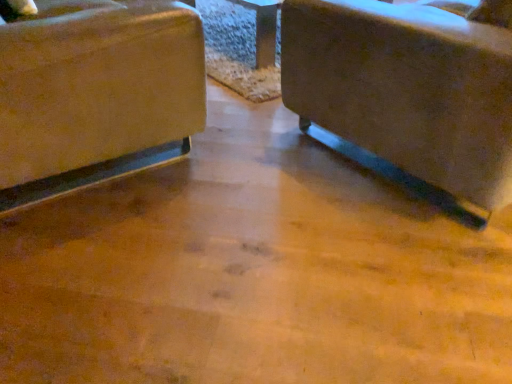
Question: In which direction should I rotate to look at matte brown chair at center, marked as the 1th chair in a right-to-left arrangement?

Choices:
 (A) right
 (B) left

Answer: (A)

Question: Should I look upward or downward to see matte beige fabric chair at left, which is counted as the 2th chair, starting from the right?

Choices:
 (A) up
 (B) down

Answer: (A)

Question: From the image's perspective, is matte beige fabric chair at left, marked as the 1th chair in a left-to-right arrangement, beneath matte brown chair at center, arranged as the 2th chair when viewed from the left?

Choices:
 (A) no
 (B) yes

Answer: (A)

Question: Considering the relative sizes of matte beige fabric chair at left, which is counted as the 2th chair, starting from the right, and matte brown chair at center, arranged as the 2th chair when viewed from the left, in the image provided, is matte beige fabric chair at left, which is counted as the 2th chair, starting from the right, thinner than matte brown chair at center, arranged as the 2th chair when viewed from the left,?

Choices:
 (A) no
 (B) yes

Answer: (B)

Question: Is matte beige fabric chair at left, which is counted as the 2th chair, starting from the right, positioned beyond the bounds of matte brown chair at center, marked as the 1th chair in a right-to-left arrangement?

Choices:
 (A) no
 (B) yes

Answer: (B)

Question: Is matte beige fabric chair at left, which is counted as the 2th chair, starting from the right, facing away from matte brown chair at center, arranged as the 2th chair when viewed from the left?

Choices:
 (A) no
 (B) yes

Answer: (A)

Question: Does matte beige fabric chair at left, which is counted as the 2th chair, starting from the right, appear on the left side of matte brown chair at center, arranged as the 2th chair when viewed from the left?

Choices:
 (A) no
 (B) yes

Answer: (B)

Question: Is matte brown chair at center, arranged as the 2th chair when viewed from the left, located within matte beige fabric chair at left, which is counted as the 2th chair, starting from the right?

Choices:
 (A) no
 (B) yes

Answer: (A)

Question: Does matte brown chair at center, marked as the 1th chair in a right-to-left arrangement, have a larger size compared to matte beige fabric chair at left, which is counted as the 2th chair, starting from the right?

Choices:
 (A) yes
 (B) no

Answer: (A)

Question: From the image's perspective, is matte brown chair at center, marked as the 1th chair in a right-to-left arrangement, located above matte beige fabric chair at left, which is counted as the 2th chair, starting from the right?

Choices:
 (A) no
 (B) yes

Answer: (A)

Question: From a real-world perspective, is matte brown chair at center, marked as the 1th chair in a right-to-left arrangement, below matte beige fabric chair at left, marked as the 1th chair in a left-to-right arrangement?

Choices:
 (A) no
 (B) yes

Answer: (A)

Question: Considering the relative sizes of matte brown chair at center, marked as the 1th chair in a right-to-left arrangement, and matte beige fabric chair at left, marked as the 1th chair in a left-to-right arrangement, in the image provided, is matte brown chair at center, marked as the 1th chair in a right-to-left arrangement, thinner than matte beige fabric chair at left, marked as the 1th chair in a left-to-right arrangement,?

Choices:
 (A) no
 (B) yes

Answer: (A)

Question: Can you confirm if matte brown chair at center, marked as the 1th chair in a right-to-left arrangement, is positioned to the right of matte beige fabric chair at left, marked as the 1th chair in a left-to-right arrangement?

Choices:
 (A) yes
 (B) no

Answer: (A)

Question: Could you tell me if matte brown chair at center, marked as the 1th chair in a right-to-left arrangement, is facing matte beige fabric chair at left, which is counted as the 2th chair, starting from the right?

Choices:
 (A) yes
 (B) no

Answer: (B)

Question: Is point (156, 46) closer or farther from the camera than point (480, 41)?

Choices:
 (A) farther
 (B) closer

Answer: (A)